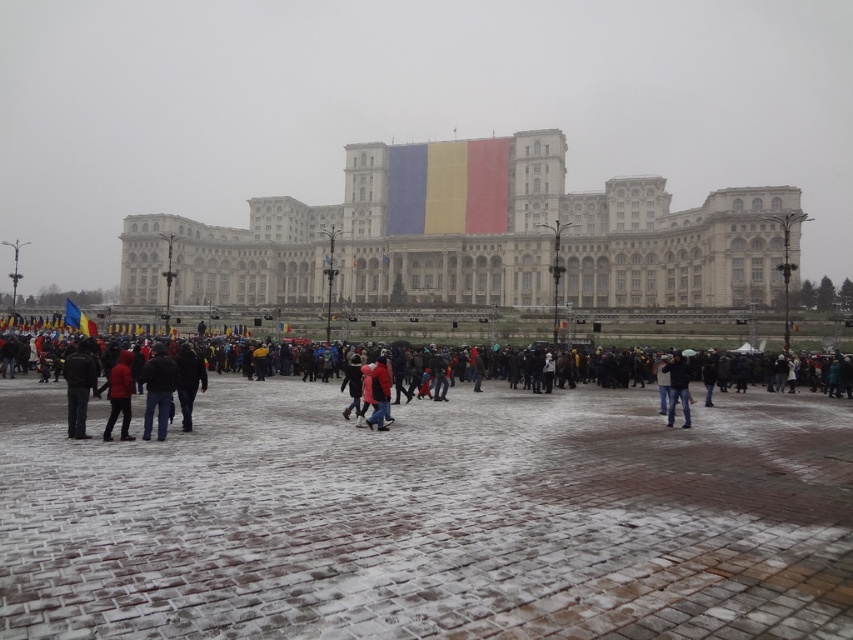
Looking at this image, you are a photographer trying to capture a photo of the dark gray pants at lower left and the jeans at center. Based on their widths, which one should you zoom in on to ensure both fit in the frame without cropping?

The dark gray pants at lower left might be wider than jeans at center, so you should zoom out slightly to capture both without cropping. However, since the width difference is uncertain, it is safer to prioritize the wider dark gray pants at lower left to ensure both fit.

You are standing in front of the grand neoclassical building with the Romanian flag. There are two points marked in the scene. Which point is closer to you, point (x=169, y=410) or point (x=183, y=390)?

Point (x=169, y=410) is closer to you than point (x=183, y=390).